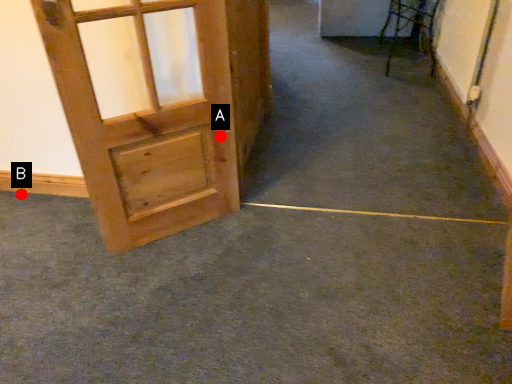
Question: Two points are circled on the image, labeled by A and B beside each circle. Among these points, which one is nearest to the camera?

Choices:
 (A) A is closer
 (B) B is closer

Answer: (A)